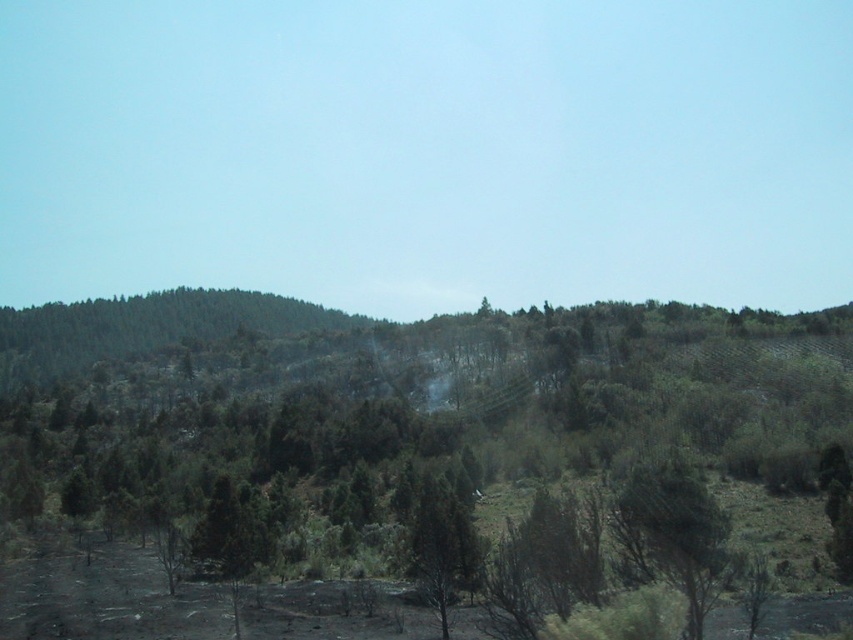
Who is shorter, green leafy tree at center or green textured tree at center?

green textured tree at center

Between green leafy tree at center and green textured tree at center, which one appears on the right side from the viewer's perspective?

From the viewer's perspective, green leafy tree at center appears more on the right side.

Does point (308, 392) come farther from viewer compared to point (643, 573)?

Yes, point (308, 392) is farther from viewer.

You are a GUI agent. You are given a task and a screenshot of the screen. Output one action in this format:
    pyautogui.click(x=<x>, y=<y>)
    Task: Click on the green leafy tree at center
    The height and width of the screenshot is (640, 853).
    Given the screenshot: What is the action you would take?
    pyautogui.click(x=434, y=438)

Does green leafy tree at center appear on the left side of green matte tree at center?

No, green leafy tree at center is not to the left of green matte tree at center.

Between point (592, 424) and point (422, 566), which one is positioned in front?

Point (422, 566) is in front.

Locate an element on the screen. green leafy tree at center is located at coordinates (434, 438).

Where is `green leafy tree at center`? The image size is (853, 640). green leafy tree at center is located at coordinates (434, 438).

Does green textured tree at center have a greater height compared to green matte tree at center?

No.

Can you confirm if green textured tree at center is bigger than green matte tree at center?

Incorrect, green textured tree at center is not larger than green matte tree at center.

The image size is (853, 640). Find the location of `green textured tree at center`. green textured tree at center is located at coordinates (672, 534).